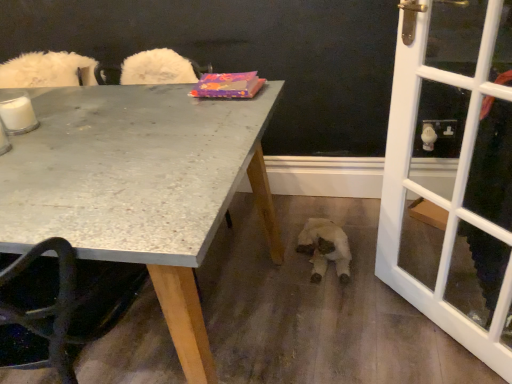
Question: Considering the relative sizes of white plush toy at lower center and white glass screen door at right in the image provided, is white plush toy at lower center taller than white glass screen door at right?

Choices:
 (A) yes
 (B) no

Answer: (B)

Question: Can you confirm if white plush toy at lower center is positioned to the right of white glass screen door at right?

Choices:
 (A) no
 (B) yes

Answer: (A)

Question: Is white plush toy at lower center positioned before white glass screen door at right?

Choices:
 (A) yes
 (B) no

Answer: (B)

Question: From a real-world perspective, is white plush toy at lower center beneath white glass screen door at right?

Choices:
 (A) no
 (B) yes

Answer: (B)

Question: Would you say white glass screen door at right is part of white plush toy at lower center's contents?

Choices:
 (A) yes
 (B) no

Answer: (B)

Question: Visually, is white glass screen door at right positioned to the left or to the right of white plush toy at lower center?

Choices:
 (A) right
 (B) left

Answer: (A)

Question: Is point (501, 322) positioned closer to the camera than point (329, 253)?

Choices:
 (A) closer
 (B) farther

Answer: (A)

Question: From the image's perspective, is white glass screen door at right above or below white plush toy at lower center?

Choices:
 (A) above
 (B) below

Answer: (A)

Question: Relative to white plush toy at lower center, is white glass screen door at right in front or behind?

Choices:
 (A) front
 (B) behind

Answer: (A)

Question: In the image, is white plush toy at lower center on the left side or the right side of white glass screen door at right?

Choices:
 (A) right
 (B) left

Answer: (B)

Question: Considering the positions of point (310, 246) and point (422, 306), is point (310, 246) closer or farther from the camera than point (422, 306)?

Choices:
 (A) closer
 (B) farther

Answer: (B)

Question: Is white plush toy at lower center in front of or behind white glass screen door at right in the image?

Choices:
 (A) front
 (B) behind

Answer: (B)

Question: Considering the positions of white plush toy at lower center and white glass screen door at right in the image, is white plush toy at lower center wider or thinner than white glass screen door at right?

Choices:
 (A) wide
 (B) thin

Answer: (A)

Question: From a real-world perspective, is white glass screen door at right positioned above or below granite gray table at upper left?

Choices:
 (A) below
 (B) above

Answer: (B)

Question: Relative to granite gray table at upper left, is white glass screen door at right in front or behind?

Choices:
 (A) front
 (B) behind

Answer: (B)